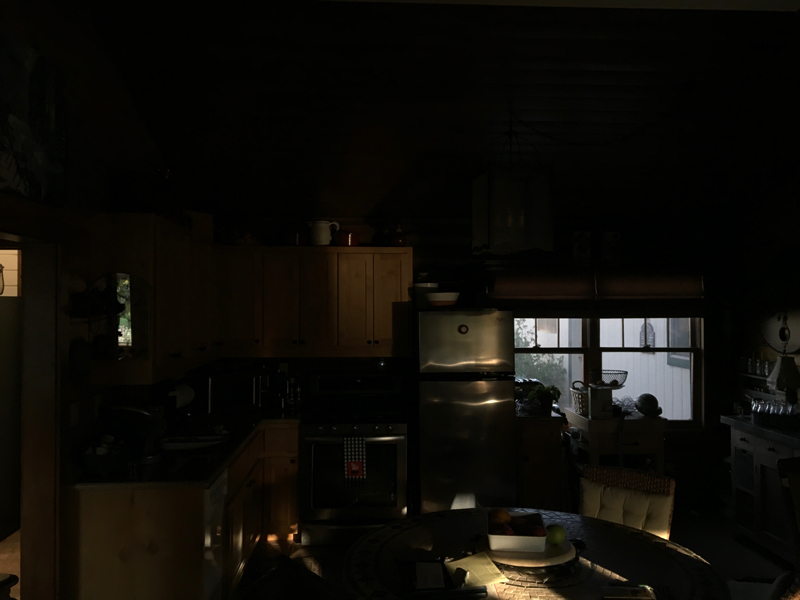
This screenshot has height=600, width=800. Find the location of `chair`. chair is located at coordinates (638, 508).